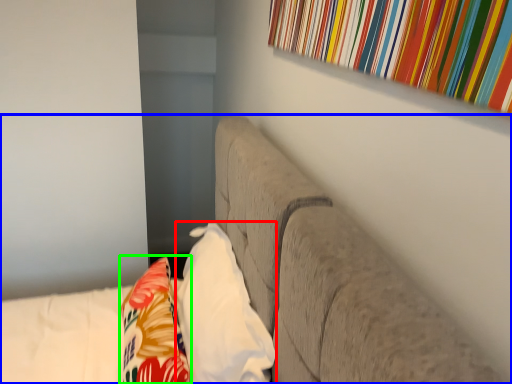
Question: Which object is positioned farthest from pillow (highlighted by a red box)? Select from furniture (highlighted by a blue box) and throw pillow (highlighted by a green box).

Choices:
 (A) furniture
 (B) throw pillow

Answer: (A)